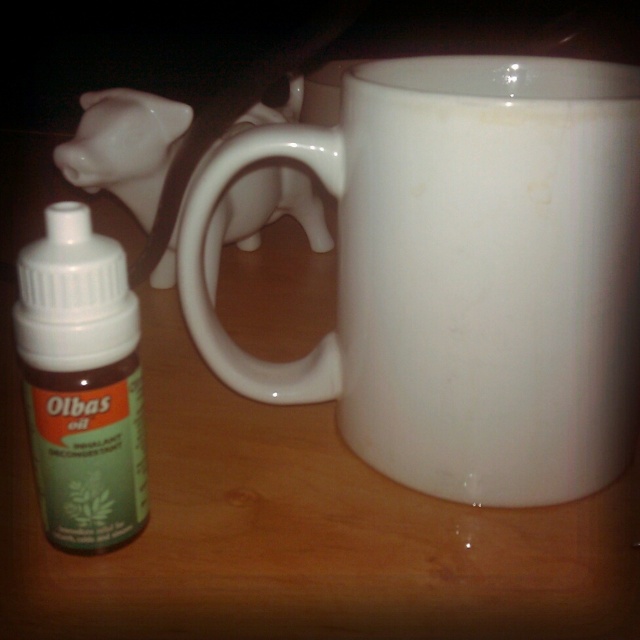
Question: Which point appears closest to the camera in this image?

Choices:
 (A) (132, 339)
 (B) (621, 186)

Answer: (A)

Question: Is white glossy mug at center wider than green matte bottle at left?

Choices:
 (A) no
 (B) yes

Answer: (B)

Question: Which point is farther from the camera taking this photo?

Choices:
 (A) [x=116, y=499]
 (B) [x=513, y=401]

Answer: (B)

Question: Which object is closer to the camera taking this photo?

Choices:
 (A) green matte bottle at left
 (B) white glossy mug at center

Answer: (A)

Question: Is white glossy mug at center to the right of green matte bottle at left from the viewer's perspective?

Choices:
 (A) no
 (B) yes

Answer: (B)

Question: Where is white glossy mug at center located in relation to green matte bottle at left in the image?

Choices:
 (A) right
 (B) left

Answer: (A)